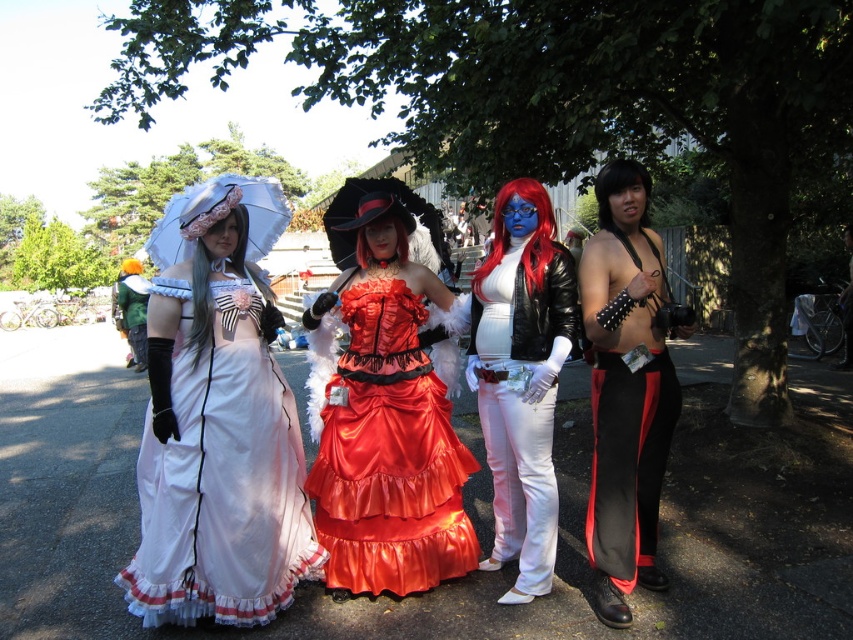
Question: Considering the real-world distances, which object is farthest from the shiny black leather pants at right?

Choices:
 (A) shiny satin dress at center
 (B) white matte pants at center

Answer: (A)

Question: Based on their relative distances, which object is nearer to the matte white dress at left?

Choices:
 (A) shiny satin dress at center
 (B) white matte pants at center

Answer: (A)

Question: Among these points, which one is nearest to the camera?

Choices:
 (A) (548, 496)
 (B) (459, 554)

Answer: (A)

Question: From the image, what is the correct spatial relationship of matte white dress at left in relation to shiny black leather pants at right?

Choices:
 (A) above
 (B) below

Answer: (B)

Question: Does shiny black leather pants at right lie in front of white matte pants at center?

Choices:
 (A) no
 (B) yes

Answer: (B)

Question: Considering the relative positions of shiny satin dress at center and white matte pants at center in the image provided, where is shiny satin dress at center located with respect to white matte pants at center?

Choices:
 (A) below
 (B) above

Answer: (B)